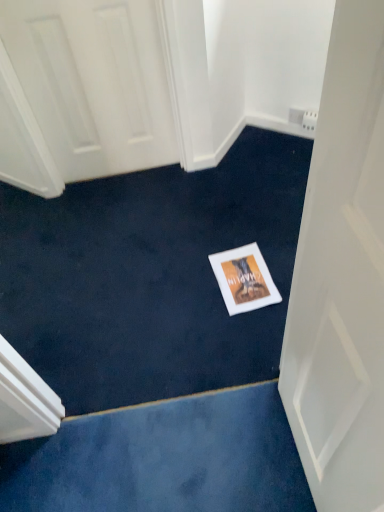
Question: Is white matte postcard at center not near white matte door at center?

Choices:
 (A) no
 (B) yes

Answer: (A)

Question: Is the depth of white matte postcard at center less than that of white matte door at center?

Choices:
 (A) no
 (B) yes

Answer: (A)

Question: From a real-world perspective, is white matte postcard at center positioned under white matte door at center based on gravity?

Choices:
 (A) yes
 (B) no

Answer: (A)

Question: Is white matte postcard at center further to camera compared to white matte door at center?

Choices:
 (A) no
 (B) yes

Answer: (B)

Question: From the image's perspective, is white matte postcard at center located above white matte door at center?

Choices:
 (A) yes
 (B) no

Answer: (A)

Question: Can you confirm if white matte postcard at center is wider than white matte door at center?

Choices:
 (A) no
 (B) yes

Answer: (B)

Question: Is white matte door at center to the left of white matte postcard at center from the viewer's perspective?

Choices:
 (A) yes
 (B) no

Answer: (B)

Question: Does white matte door at center have a lesser height compared to white matte postcard at center?

Choices:
 (A) yes
 (B) no

Answer: (B)

Question: Is there a large distance between white matte door at center and white matte postcard at center?

Choices:
 (A) no
 (B) yes

Answer: (A)

Question: Could you tell me if white matte door at center is facing white matte postcard at center?

Choices:
 (A) yes
 (B) no

Answer: (B)

Question: From the image's perspective, is white matte door at center beneath white matte postcard at center?

Choices:
 (A) no
 (B) yes

Answer: (B)

Question: Considering the relative sizes of white matte door at center and white matte postcard at center in the image provided, is white matte door at center wider than white matte postcard at center?

Choices:
 (A) no
 (B) yes

Answer: (A)

Question: Is white matte door at center inside the boundaries of white matte postcard at center, or outside?

Choices:
 (A) outside
 (B) inside

Answer: (A)